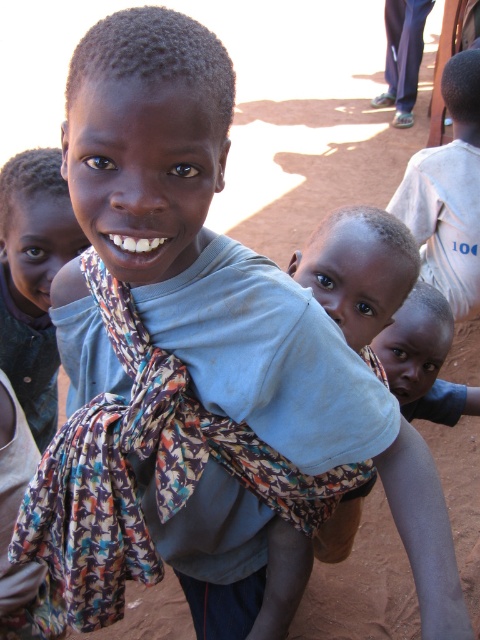
Does point (7, 224) come behind point (465, 168)?

No.

Does point (56, 173) lie in front of point (416, 173)?

That is True.

Locate an element on the screen. light blue fabric at center is located at coordinates (33, 278).